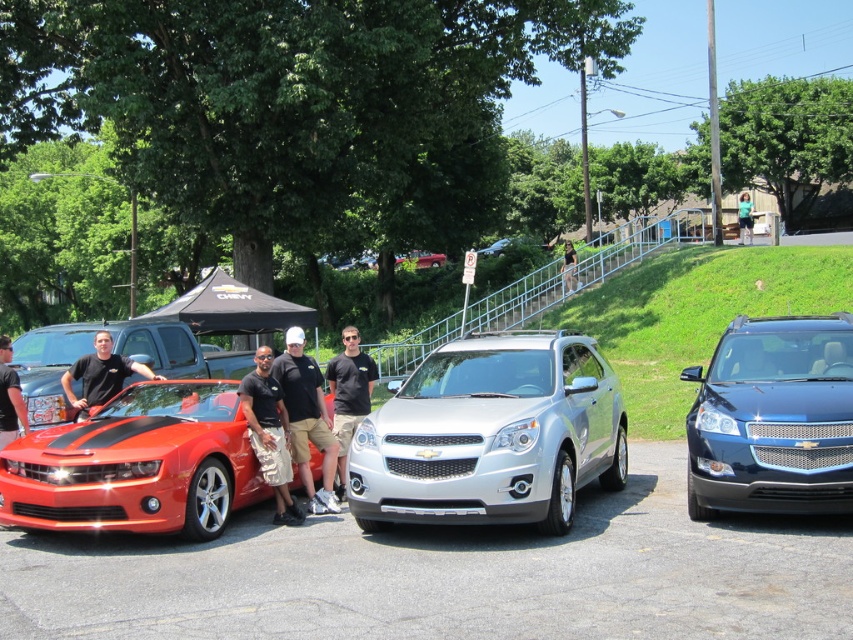
You are a photographer at a car show and need to capture a photo of the silver metallic suv at center and the shiny red car at left. Based on their positions, which vehicle should you focus on first if you want to ensure both are in frame without moving the camera?

The silver metallic suv at center is below the shiny red car at left, so you should focus on the shiny red car at left first to ensure both are in frame without moving the camera.

In the scene shown: Based on the scene description, where is the silver metallic suv at center located in the image?

→ The silver metallic suv at center is located at point [491,435].